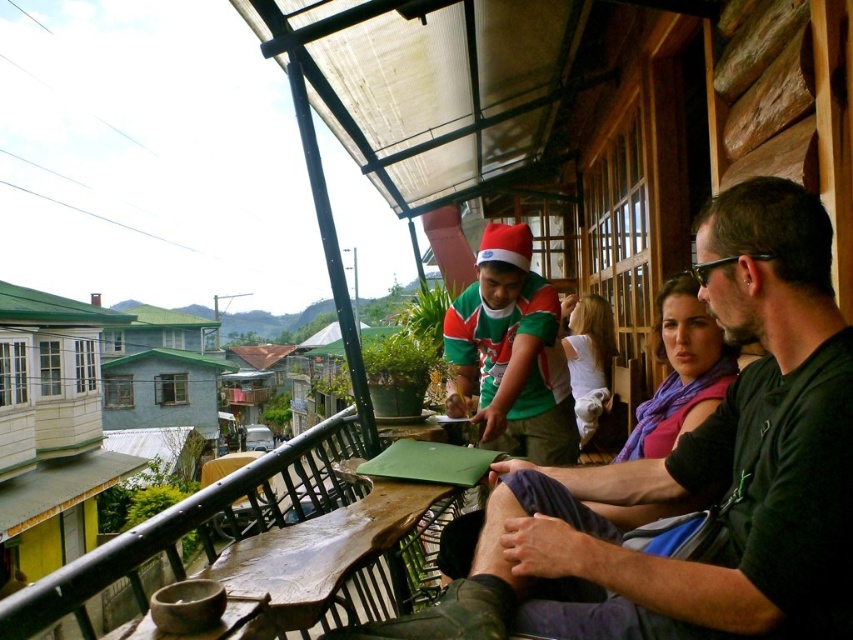
Does green jersey at center have a greater width compared to green knitted sweater at center?

Yes.

Which of these two, green jersey at center or green knitted sweater at center, stands shorter?

green jersey at center is shorter.

Is point (613, 490) positioned in front of point (511, 276)?

Yes.

Identify the location of green jersey at center. The image size is (853, 640). click(x=695, y=474).